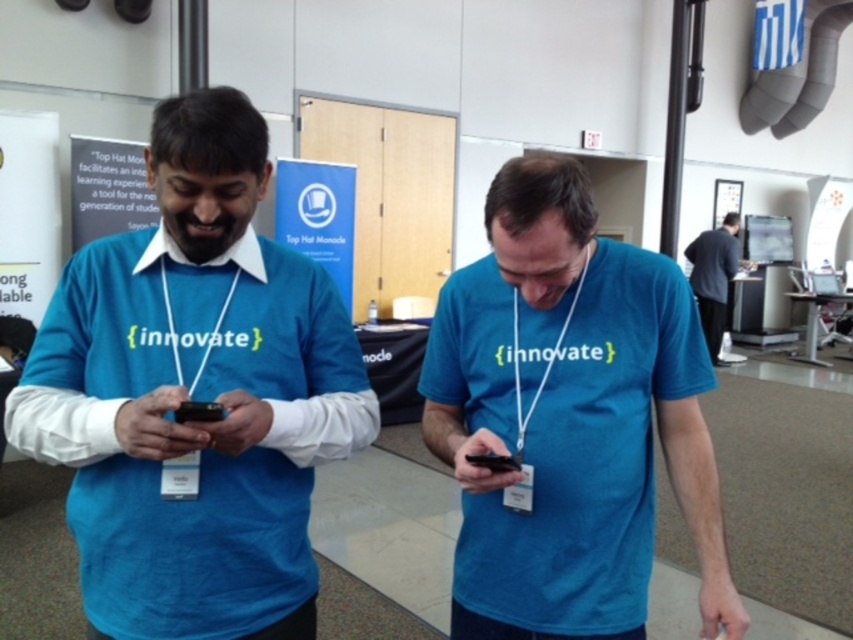
You are organizing a photo shoot and need to position the dark gray suit at right and the white paper at left in a way that maintains their current height relationship. Which object should be placed higher to ensure the height difference is preserved?

To maintain the height difference where the dark gray suit at right is taller than the white paper at left, the dark gray suit at right should be placed higher than the white paper at left.